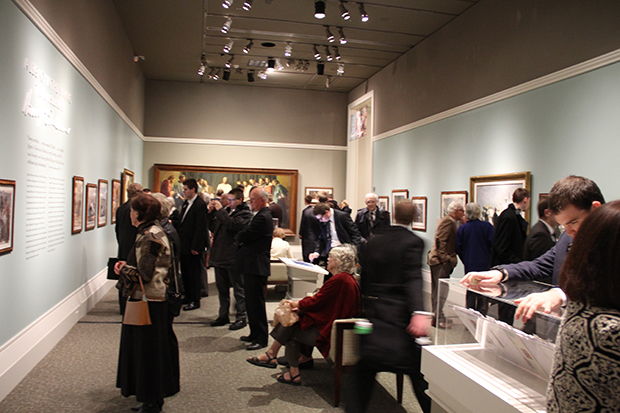
The height and width of the screenshot is (413, 620). In order to click on clear display case in this screenshot , I will do `click(480, 308)`, `click(550, 328)`.